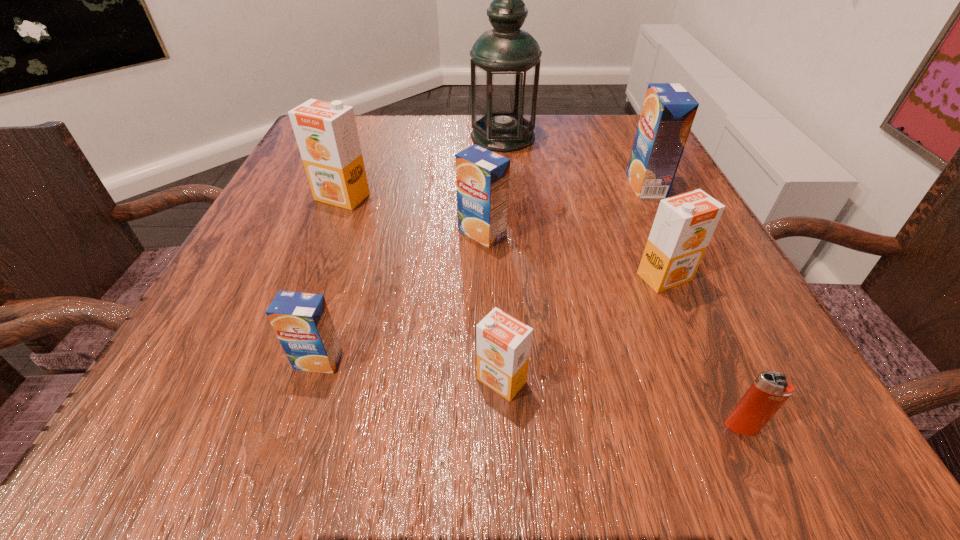
Point out which blue orange_juice is positioned as the nearest to the fourth farthest orange juice. Please provide its 2D coordinates. Your answer should be formatted as a tuple, i.e. [(x, y)], where the tuple contains the x and y coordinates of a point satisfying the conditions above.

[(668, 112)]